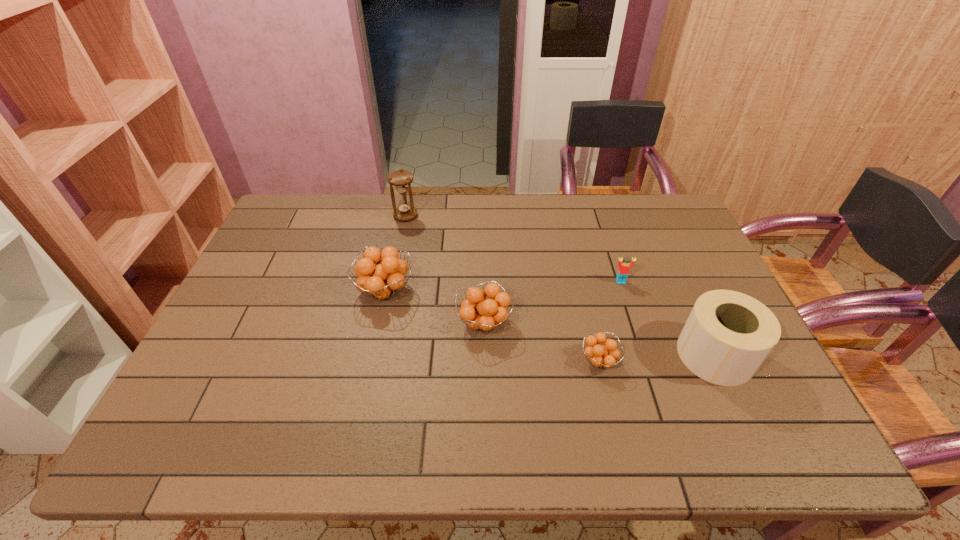
You are a GUI agent. You are given a task and a screenshot of the screen. Output one action in this format:
    pyautogui.click(x=<x>, y=<y>)
    Task: Click on the leftmost orange fruit
    This screenshot has width=960, height=540.
    Given the screenshot: What is the action you would take?
    pyautogui.click(x=383, y=281)

Where is `the second orange fruit from right to left`? the second orange fruit from right to left is located at coordinates (484, 315).

Locate an element on the screen. the fourth object from right to left is located at coordinates (484, 315).

Find the location of `the rightmost orange fruit`. the rightmost orange fruit is located at coordinates (604, 356).

This screenshot has height=540, width=960. I want to click on the third object from right to left, so click(x=604, y=356).

The height and width of the screenshot is (540, 960). I want to click on hourglass, so click(401, 179).

The image size is (960, 540). In order to click on Lego in this screenshot , I will do `click(624, 268)`.

Where is `the second shortest object`? This screenshot has height=540, width=960. the second shortest object is located at coordinates (624, 268).

I want to click on the rightmost object, so click(x=728, y=335).

The height and width of the screenshot is (540, 960). In order to click on free point located 0.170m on the left of the leftmost orange fruit in this screenshot , I will do `click(296, 291)`.